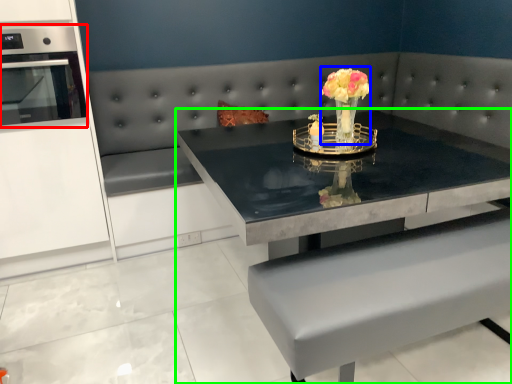
Question: Which object is positioned closest to appliance (highlighted by a red box)? Select from floral arrangement (highlighted by a blue box) and table (highlighted by a green box).

Choices:
 (A) floral arrangement
 (B) table

Answer: (B)